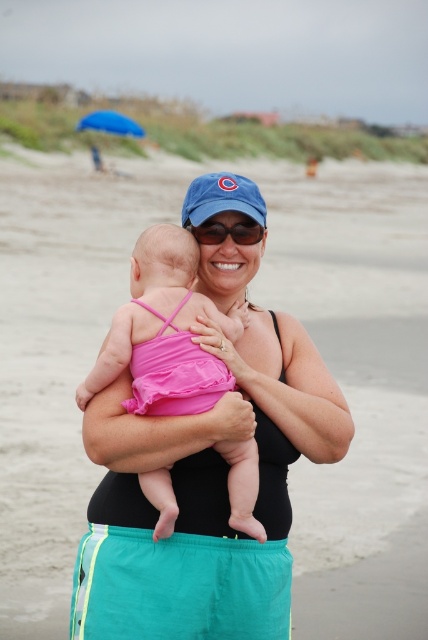
You are a photographer trying to capture a closeup shot of the baby in the image. You need to ensure that both the matte black swimsuit at center and the black matte arm at center are in focus. Given their sizes, which object should you adjust your focus on first to ensure clarity?

The matte black swimsuit at center is wider than the black matte arm at center, so you should focus on the larger matte black swimsuit at center first to ensure both are in focus.

Consider the image. You are a photographer at the beach and need to capture a closeup shot of the baby. Which object, the matte black swimsuit at center or the black matte arm at center, should you focus on to ensure the baby is in the frame?

The matte black swimsuit at center is taller than the black matte arm at center, so focusing on the matte black swimsuit at center will ensure the baby is in the frame.

You are a photographer at the beach and want to capture the pink fabric baby at center and the blue fabric umbrella at upper left in the same frame. Which object is positioned lower in the image?

The pink fabric baby at center is located below the blue fabric umbrella at upper left, so the pink fabric baby at center is positioned lower in the image.